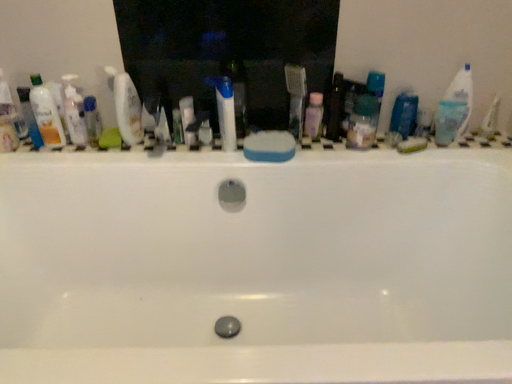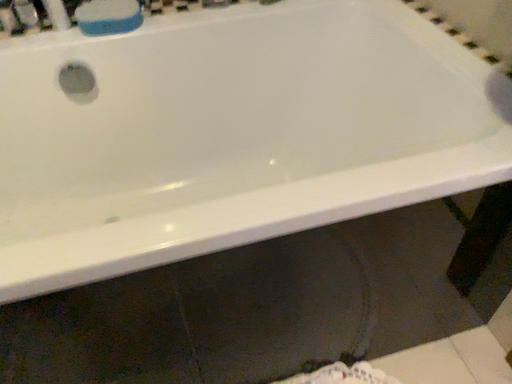
Question: How did the camera likely rotate when shooting the video?

Choices:
 (A) rotated left
 (B) rotated right

Answer: (B)